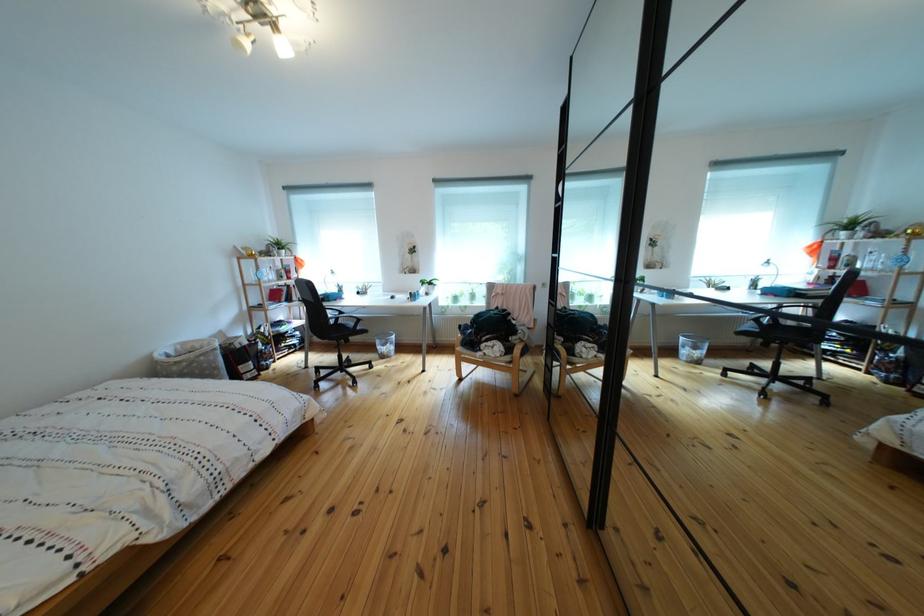
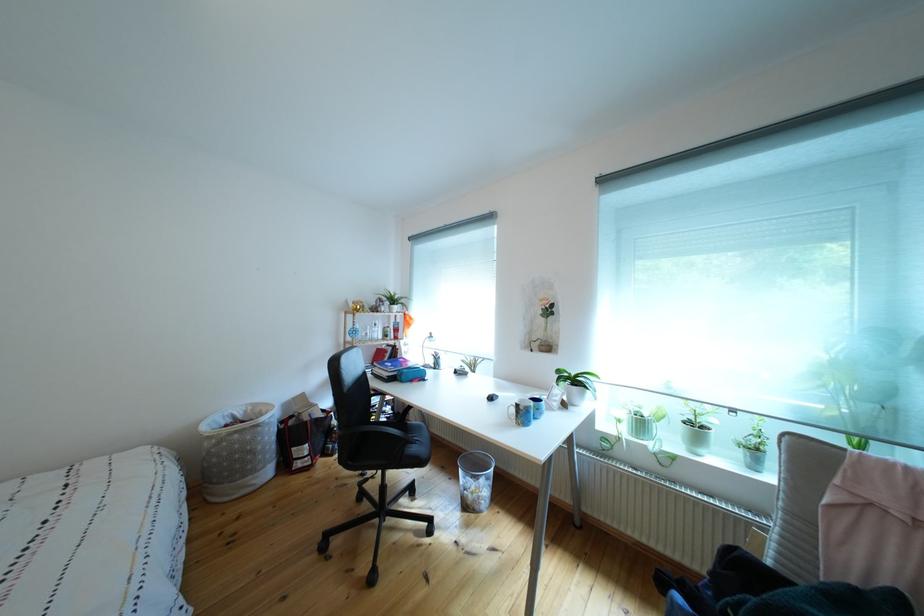
The point at (273, 352) is marked in the first image. Where is the corresponding point in the second image?

(346, 428)